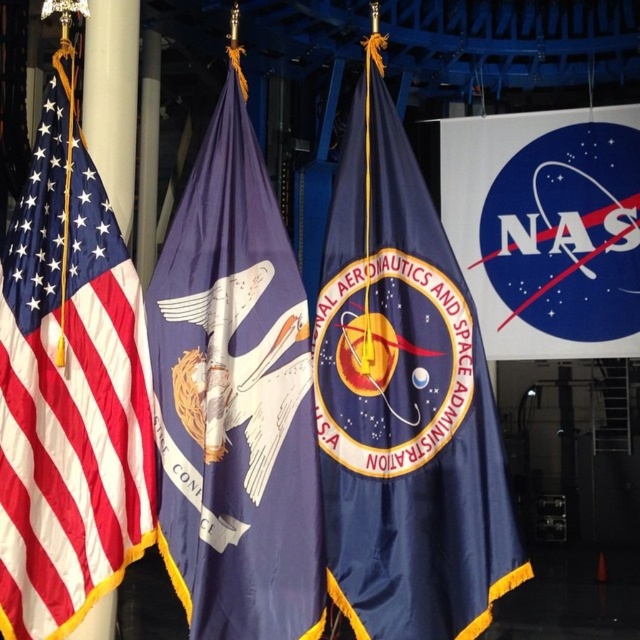
Who is positioned more to the left, matte blue flag with white emblem at center or matte fabric flag at left?

matte fabric flag at left is more to the left.

Does matte blue flag with white emblem at center appear under matte fabric flag at left?

Yes, matte blue flag with white emblem at center is below matte fabric flag at left.

Between point (310, 540) and point (99, 211), which one is positioned behind?

The point (99, 211) is more distant.

The width and height of the screenshot is (640, 640). What are the coordinates of `matte blue flag with white emblem at center` in the screenshot? It's located at (234, 397).

What do you see at coordinates (403, 401) in the screenshot? Image resolution: width=640 pixels, height=640 pixels. I see `navy blue satin nasa flag at center` at bounding box center [403, 401].

Is point (340, 257) farther from camera compared to point (204, 592)?

Yes, point (340, 257) is behind point (204, 592).

What do you see at coordinates (403, 401) in the screenshot? I see `navy blue satin nasa flag at center` at bounding box center [403, 401].

This screenshot has width=640, height=640. In order to click on navy blue satin nasa flag at center in this screenshot , I will do `click(403, 401)`.

Who is taller, navy blue satin nasa flag at center or matte fabric flag at left?

Standing taller between the two is matte fabric flag at left.

Describe the element at coordinates (403, 401) in the screenshot. The height and width of the screenshot is (640, 640). I see `navy blue satin nasa flag at center` at that location.

Does point (435, 621) lie behind point (4, 428)?

No, it is in front of (4, 428).

Locate an element on the screen. Image resolution: width=640 pixels, height=640 pixels. navy blue satin nasa flag at center is located at coordinates point(403,401).